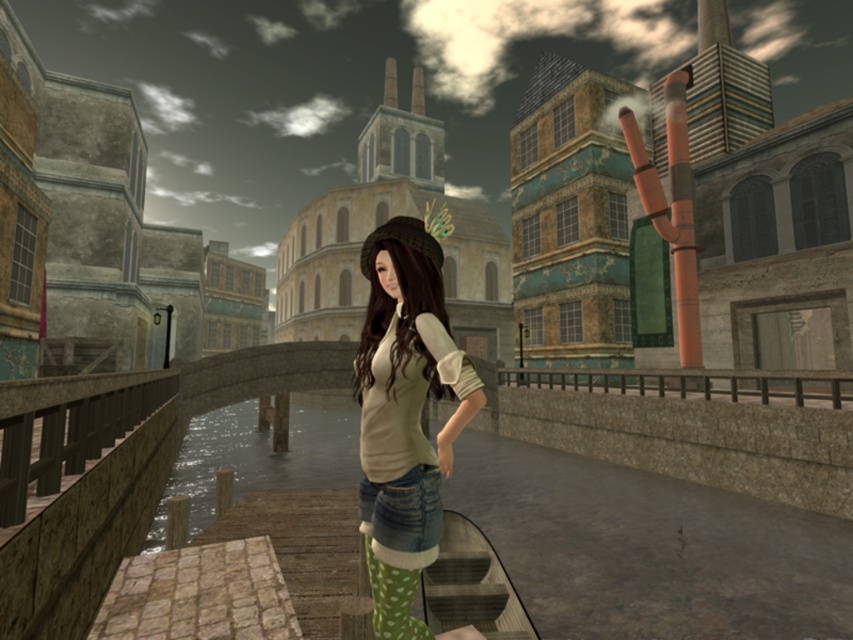
You are a delivery drone flying over an industrial area. You need to land on the brown wooden rail at right but must avoid hitting the matte green boots at center. Can you safely land there?

The matte green boots at center is taller than the brown wooden rail at right, so the drone cannot safely land on the brown wooden rail at right without hitting the matte green boots at center.

You are a delivery drone that needs to land on the dock. The landing area must be wider than your 1.2 meter width. Can you land on the clear water at dock center instead of the matte green boots at center?

The clear water at dock center is wider than the matte green boots at center. Since the clear water at dock center is wider than 1.2 meters, the drone can land there safely.

You are on the dock and want to pour a drink into the clear water at dock center without getting the brown wooden rail at right wet. Which direction should you pour the drink?

You should pour the drink to the left of the brown wooden rail at right, since the clear water at dock center is located there.